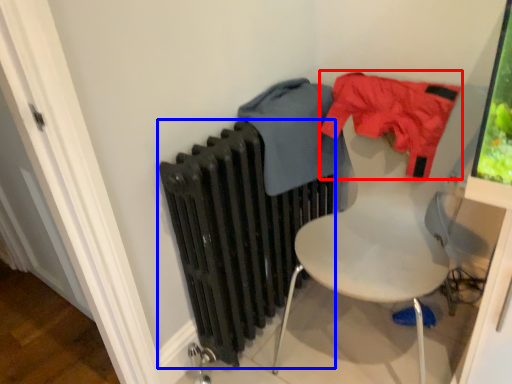
Question: Among these objects, which one is farthest to the camera, clothing (highlighted by a red box) or radiator (highlighted by a blue box)?

Choices:
 (A) clothing
 (B) radiator

Answer: (A)